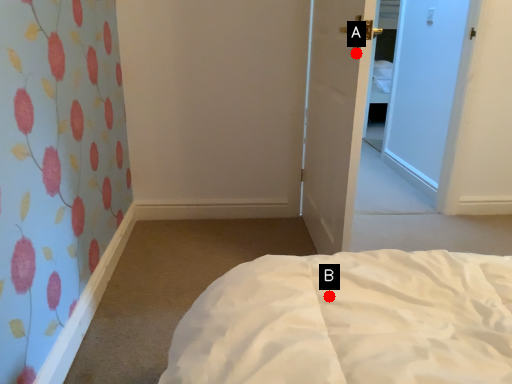
Question: Two points are circled on the image, labeled by A and B beside each circle. Which point is farther from the camera taking this photo?

Choices:
 (A) A is further
 (B) B is further

Answer: (A)